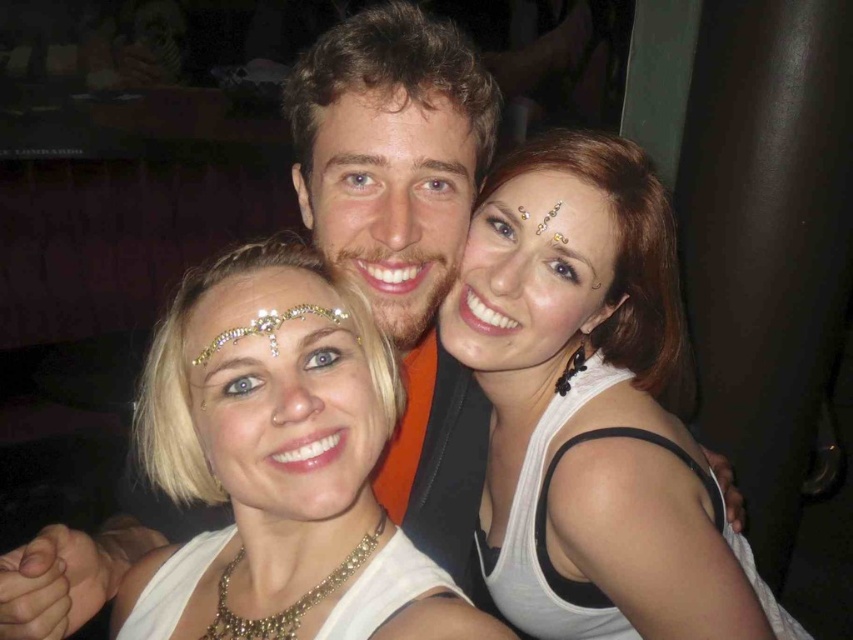
Based on the photo, is white matte necklace at center to the right of matte gold headband at center from the viewer's perspective?

Incorrect, white matte necklace at center is not on the right side of matte gold headband at center.

Between white matte necklace at center and matte gold headband at center, which one appears on the left side from the viewer's perspective?

From the viewer's perspective, white matte necklace at center appears more on the left side.

Is point (200, 486) positioned after point (523, 364)?

That is False.

Locate an element on the screen. This screenshot has width=853, height=640. white matte necklace at center is located at coordinates (279, 467).

Can you confirm if white matte necklace at center is positioned above matte skin face at center?

Incorrect, white matte necklace at center is not positioned above matte skin face at center.

Which of these two, white matte necklace at center or matte skin face at center, stands shorter?

matte skin face at center

I want to click on white matte necklace at center, so click(x=279, y=467).

Who is higher up, white matte necklace at center or white matte headband at center?

white matte headband at center is above.

Between white matte necklace at center and white matte headband at center, which one appears on the right side from the viewer's perspective?

Positioned to the right is white matte headband at center.

Which is in front, point (274, 307) or point (339, 388)?

Point (339, 388)

You are a GUI agent. You are given a task and a screenshot of the screen. Output one action in this format:
    pyautogui.click(x=<x>, y=<y>)
    Task: Click on the white matte necklace at center
    
    Given the screenshot: What is the action you would take?
    pyautogui.click(x=279, y=467)